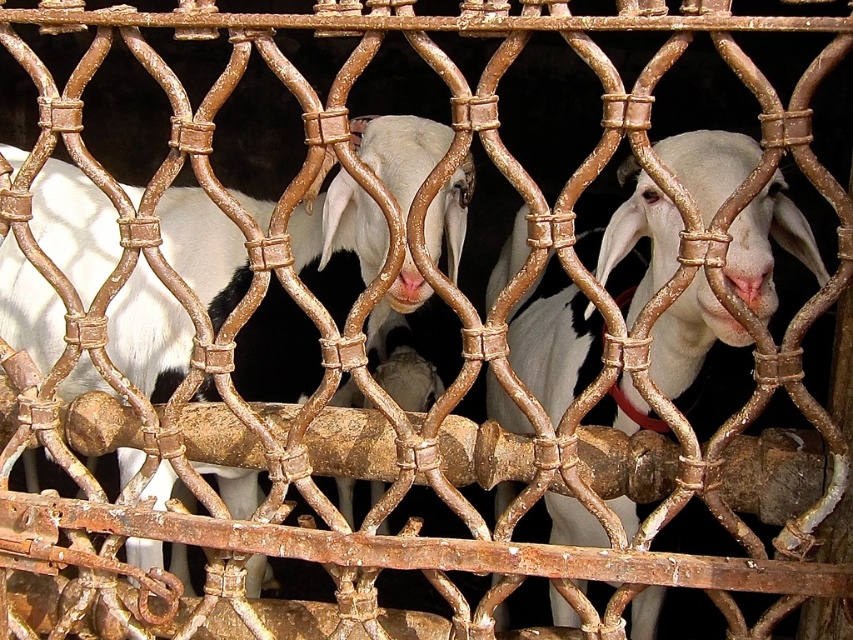
Consider the image. You are a farmer who wants to identify the taller goat to give it more feed. Looking through the fence, which goat should you choose between the white woolen goat at center and the white matte goat at center?

The white woolen goat at center is much taller than the white matte goat at center, so you should choose the white woolen goat at center to give it more feed.

You are standing in front of a rusty metal fence with two goats. You notice a white woolen goat at center and a white matte goat at center. Which goat is closer to you?

The white woolen goat at center is closer to you than the white matte goat at center.